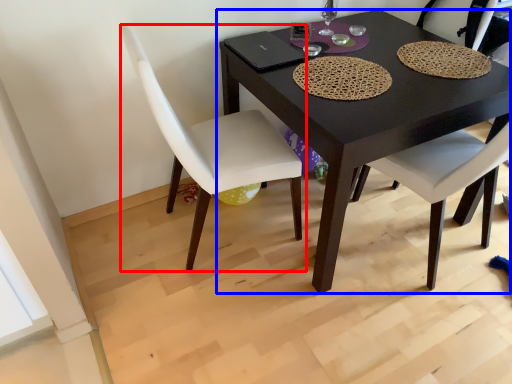
Question: Which point is further to the camera, chair (highlighted by a red box) or table (highlighted by a blue box)?

Choices:
 (A) chair
 (B) table

Answer: (B)